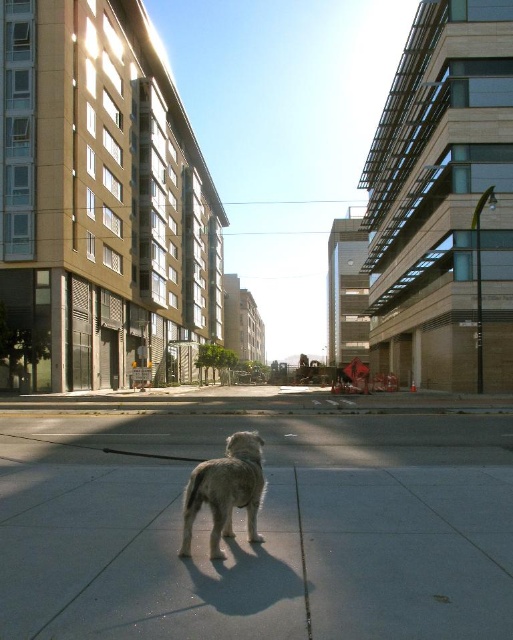
Based on the photo, who is more forward, (174, 426) or (185, 545)?

Point (185, 545) is in front.

Between gray concrete pavement at center and light brown fur dog at center, which one is positioned higher?

light brown fur dog at center

Who is more forward, (48,541) or (253,472)?

Point (253,472)

I want to click on gray concrete pavement at center, so click(261, 531).